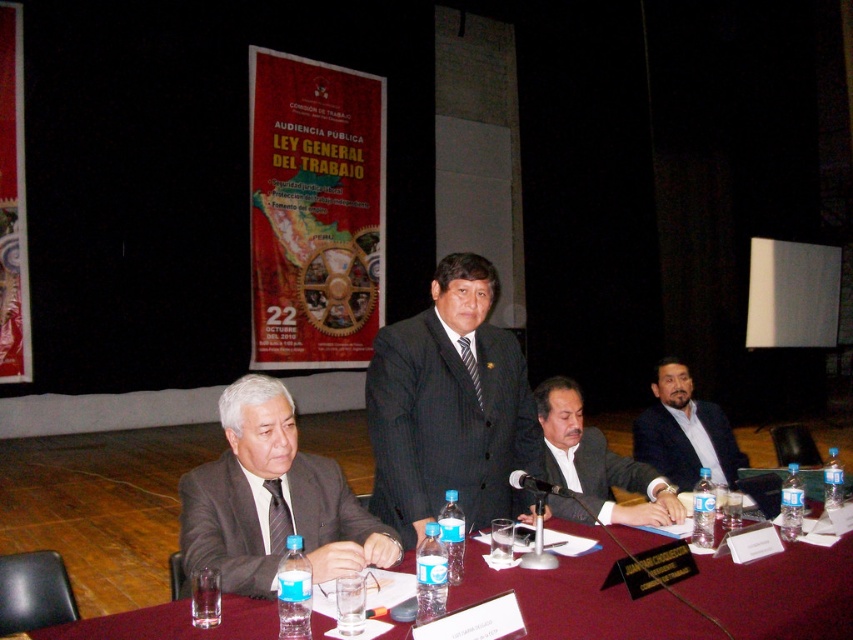
Question: Does translucent plastic water at table center appear on the left side of dark blue suit at center?

Choices:
 (A) yes
 (B) no

Answer: (A)

Question: Where is translucent plastic water at table center located in relation to dark gray pinstripe suit at center in the image?

Choices:
 (A) right
 (B) left

Answer: (A)

Question: Which point is closer to the camera?

Choices:
 (A) dark blue suit at center
 (B) white shirt at center
 (C) matte gray suit at center

Answer: (C)

Question: Which point appears closest to the camera in this image?

Choices:
 (A) (4, 205)
 (B) (367, 228)

Answer: (A)

Question: Does white shirt at center appear over dark blue suit at center?

Choices:
 (A) yes
 (B) no

Answer: (A)

Question: Which point appears farthest from the camera in this image?

Choices:
 (A) (660, 436)
 (B) (254, 636)
 (C) (605, 516)

Answer: (A)